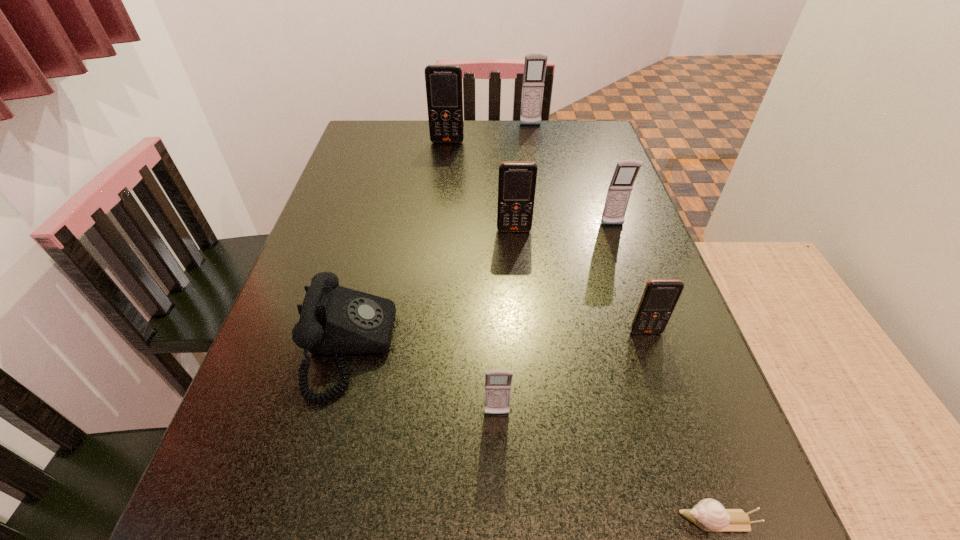
Locate an element on the screen. The width and height of the screenshot is (960, 540). the nearest cellular telephone is located at coordinates 497,382.

I want to click on the nearest gray cellular telephone, so click(x=497, y=382).

Locate an element on the screen. The height and width of the screenshot is (540, 960). the seventh tallest object is located at coordinates (334, 320).

Find the location of a particular element. The image size is (960, 540). telephone is located at coordinates (334, 320).

Find the location of a particular element. the nearest object is located at coordinates (709, 515).

Where is `the shortest object`? Image resolution: width=960 pixels, height=540 pixels. the shortest object is located at coordinates (709, 515).

The image size is (960, 540). In order to click on vacant region located on the front-facing side of the farthest cellular telephone in this screenshot , I will do `click(535, 151)`.

Locate an element on the screen. vacant region located on the screen of the biggest orange cellular telephone is located at coordinates (440, 215).

The image size is (960, 540). What are the coordinates of `vacant space located on the front-facing side of the second nearest gray cellular telephone` in the screenshot? It's located at (645, 320).

Identify the location of free space located 0.360m on the screen of the second orange cellular telephone from right to left. This screenshot has width=960, height=540. (526, 363).